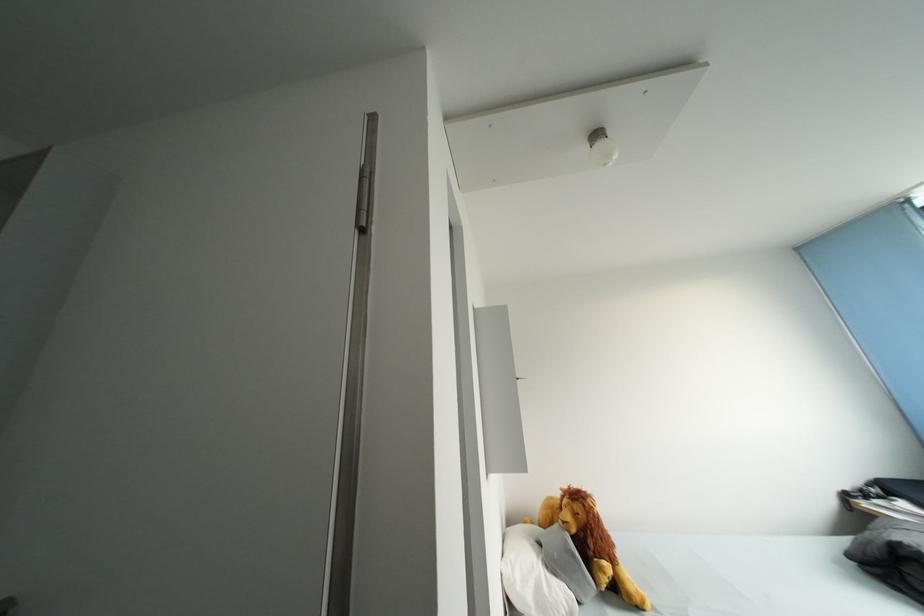
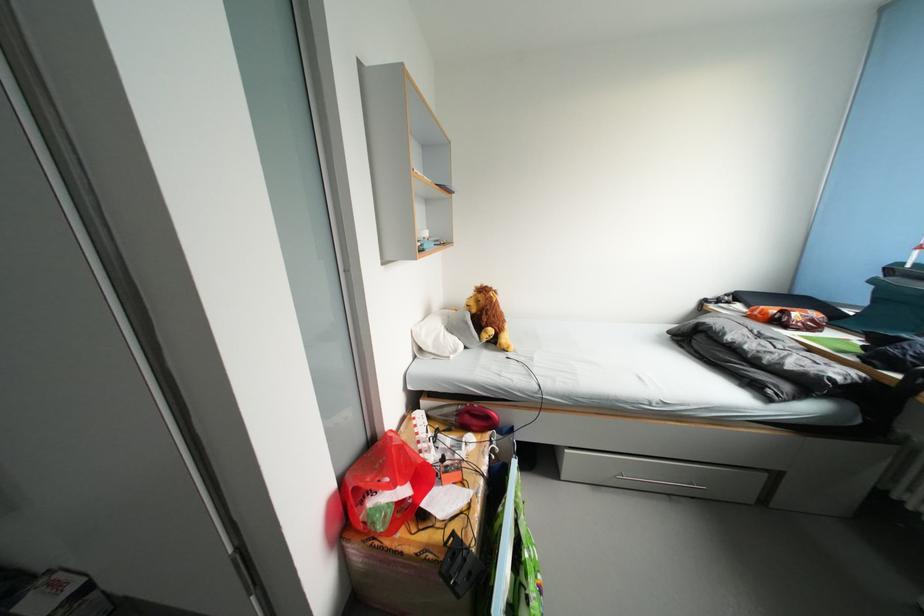
The point at (555, 573) is marked in the first image. Where is the corresponding point in the second image?

(456, 334)